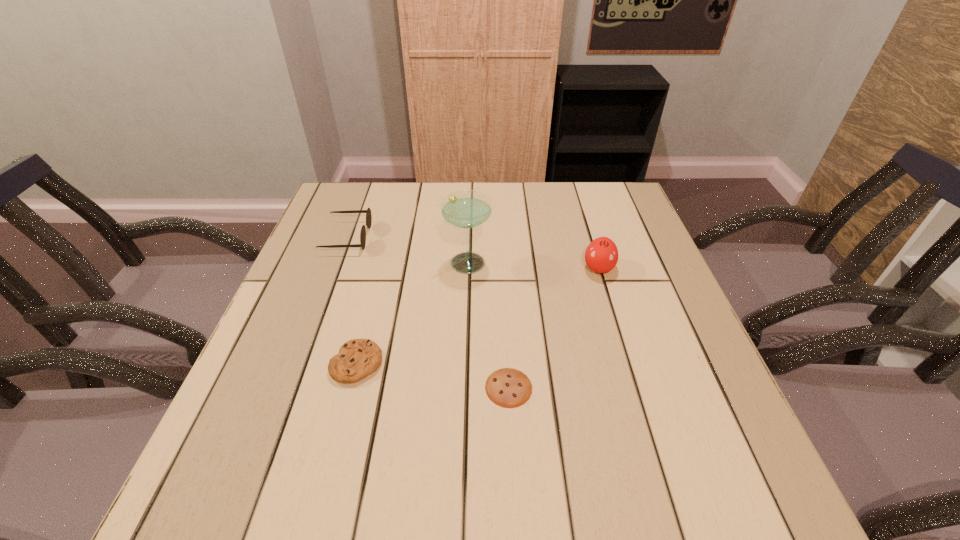
Image resolution: width=960 pixels, height=540 pixels. What are the coordinates of `vacant space at the near edge of the desktop` in the screenshot? It's located at (318, 473).

Where is `vacant space at the left edge`? Image resolution: width=960 pixels, height=540 pixels. vacant space at the left edge is located at coordinates (276, 449).

Identify the location of vacant space at the right edge of the desktop. (636, 270).

In the image, there is a desktop. Where is `vacant space at the far left corner`? vacant space at the far left corner is located at coordinates (369, 207).

Where is `vacant area at the near right corner`? This screenshot has height=540, width=960. vacant area at the near right corner is located at coordinates (699, 478).

The width and height of the screenshot is (960, 540). What are the coordinates of `free point between the taller cookie and the martini` in the screenshot? It's located at (412, 312).

Image resolution: width=960 pixels, height=540 pixels. I want to click on free spot between the tallest object and the third tallest object, so click(406, 249).

The width and height of the screenshot is (960, 540). In order to click on free spot between the right cookie and the martini in this screenshot , I will do `click(488, 325)`.

Where is `unoccupied position between the left cookie and the second tallest object`? unoccupied position between the left cookie and the second tallest object is located at coordinates (478, 316).

Where is `vacant space in between the right cookie and the leftmost object`? vacant space in between the right cookie and the leftmost object is located at coordinates (428, 313).